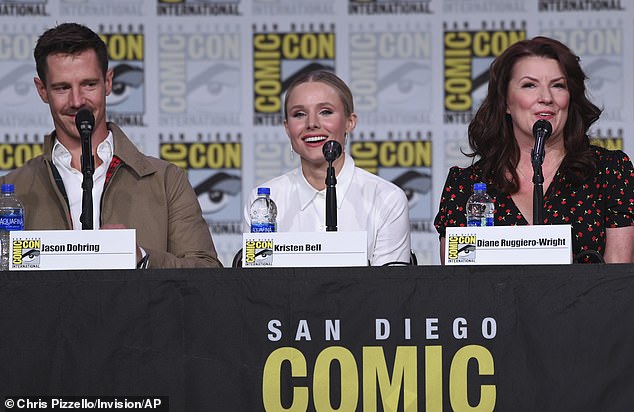
Where is `backdrop`? backdrop is located at coordinates (428, 120).